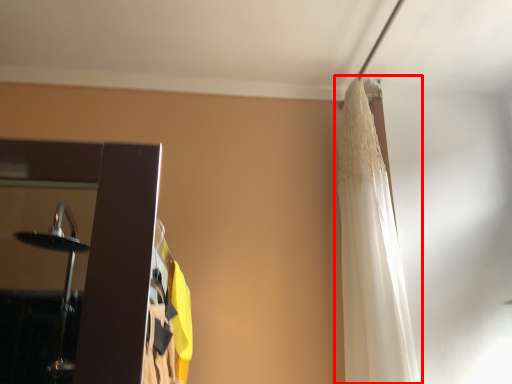
Question: Considering the relative positions of curtain (annotated by the red box) and curtain in the image provided, where is curtain (annotated by the red box) located with respect to the staircase?

Choices:
 (A) right
 (B) left

Answer: (A)